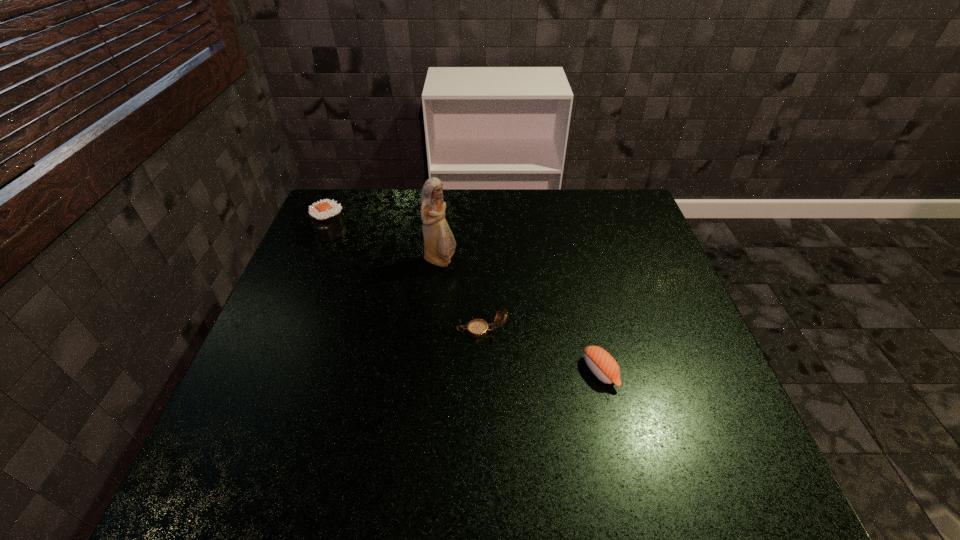
The height and width of the screenshot is (540, 960). Identify the location of the second farthest object. (439, 243).

Find the location of a particular element. The height and width of the screenshot is (540, 960). the tallest object is located at coordinates [439, 243].

Find the location of a particular element. The image size is (960, 540). the farthest object is located at coordinates [326, 217].

Locate an element on the screen. the taller sushi is located at coordinates (326, 217).

What are the coordinates of `compass` in the screenshot? It's located at (477, 328).

Identify the location of the second shortest object. Image resolution: width=960 pixels, height=540 pixels. (477, 328).

I want to click on the shorter sushi, so click(600, 362).

You are a GUI agent. You are given a task and a screenshot of the screen. Output one action in this format:
    pyautogui.click(x=<x>, y=<y>)
    Task: Click on the nearer sushi
    The height and width of the screenshot is (540, 960).
    Given the screenshot: What is the action you would take?
    pyautogui.click(x=600, y=362)

Find the location of `free location located 0.080m on the front-facing side of the third object from right to left`. free location located 0.080m on the front-facing side of the third object from right to left is located at coordinates (486, 261).

Find the location of a particular element. This screenshot has height=540, width=960. free space located 0.300m on the right of the third shortest object is located at coordinates (446, 232).